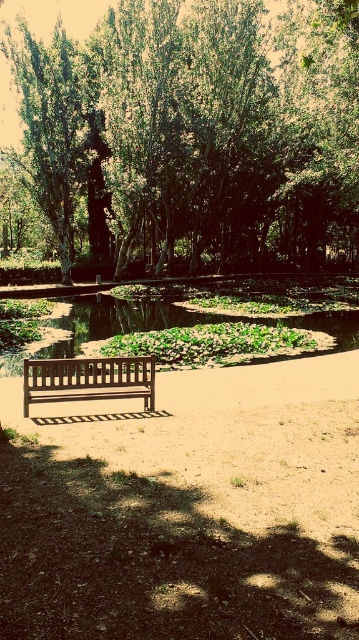
You are a photographer planning to take a photo of the green leafy tree at upper center and the green leafy pond at center. Based on the scene, which object will appear closer to the camera in the final photo?

The green leafy tree at upper center will appear closer to the camera because it is positioned in front of the green leafy pond at center according to the scene description.

You are a visitor in the park and want to take a photo of both the green leafy tree at upper center and the wooden bench at center. Which object should you focus on first if you want to include both in your frame without moving the camera?

The green leafy tree at upper center is taller than the wooden bench at center, so you should focus on the green leafy tree at upper center first to ensure both are in frame.

You are standing in the park and want to reach the wooden bench. If you walk straight ahead, will you reach the bench before reaching the point at coordinates point (x=174, y=312)?

The point at coordinates point (x=174, y=312) is 32.61 meters away from the viewer. Since the bench is closer than this point, you will reach the bench before reaching the point at coordinates point (x=174, y=312).